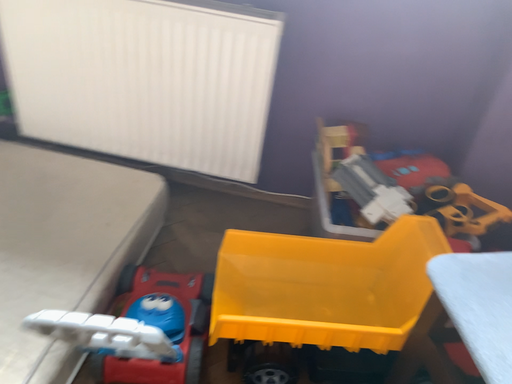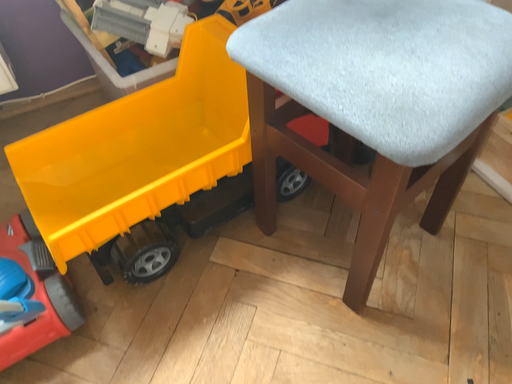
Question: How did the camera likely rotate when shooting the video?

Choices:
 (A) rotated left
 (B) rotated right

Answer: (B)